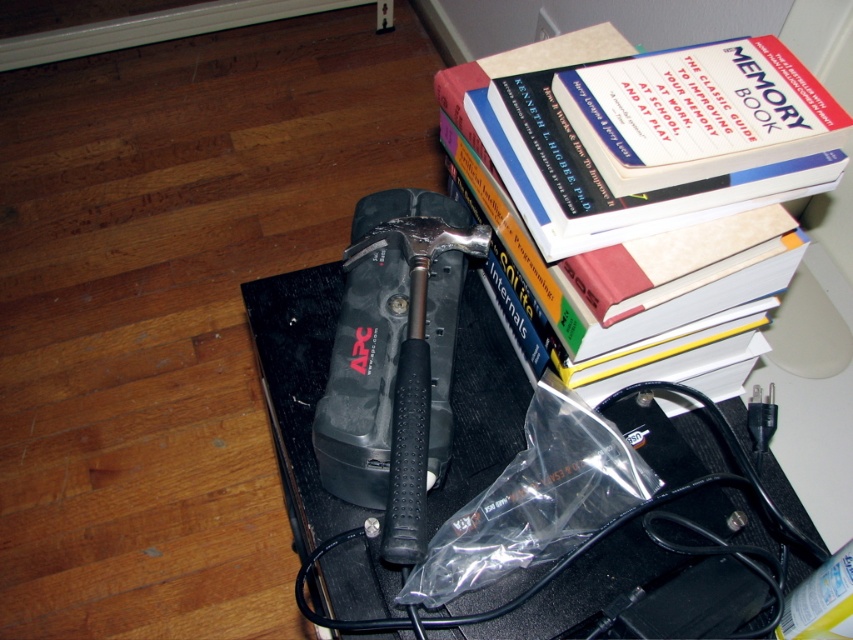
You are standing in front of a desk and need to place a 24 inch wide laptop on the black plastic table at center. Can the laptop fit on the table?

The black plastic table at center is 23.61 inches away from the viewer, but the question is about the table width. Since the table width isn

You are a photographer standing at the camera position. You want to take a closeup shot of the point marked at coordinates point (659, 412). Can you reach the point without moving your feet?

The point marked at coordinates point (659, 412) is 28.78 inches away from the camera. Since the photographer can typically reach about 24 inches without moving their feet, they cannot reach the point without moving closer.

Looking at this image, you are standing at the center of the image and want to place a new item exactly at the point marked by point (395, 360). What object is currently located at that position?

The point (395, 360) marks the location of the black rubberized hammer at center.